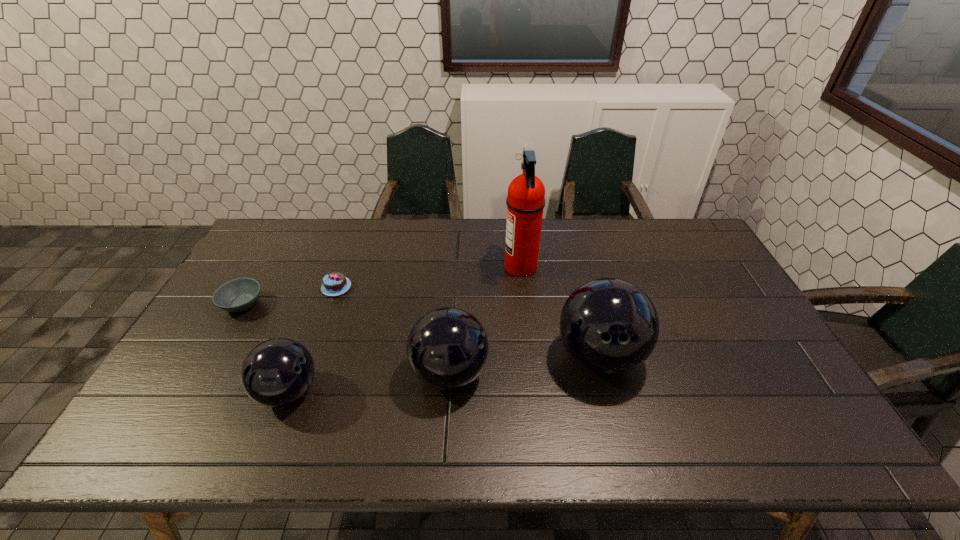
Please point a spot on the right to add another bowling ball. Please provide its 2D coordinates. Your answer should be formatted as a tuple, i.e. [(x, y)], where the tuple contains the x and y coordinates of a point satisfying the conditions above.

[(740, 340)]